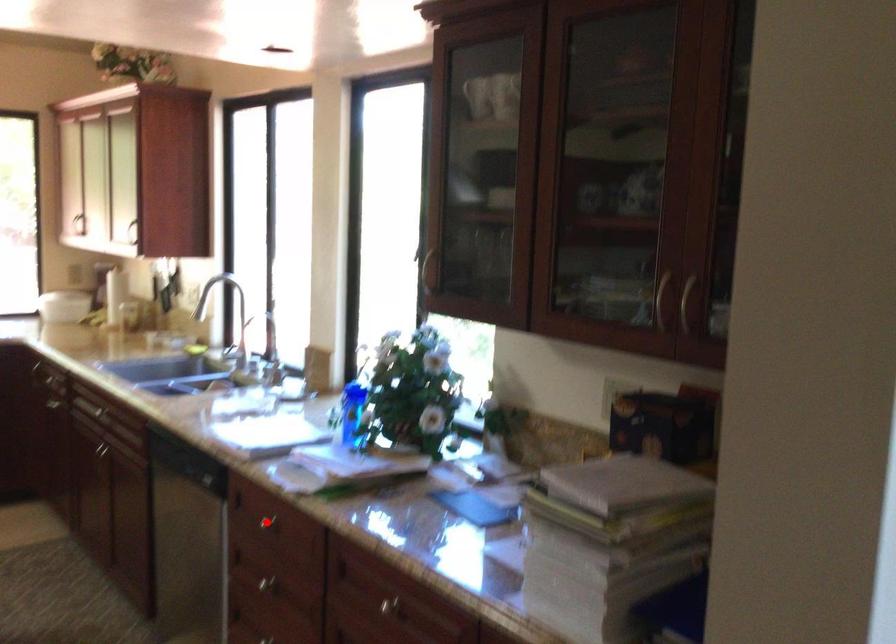
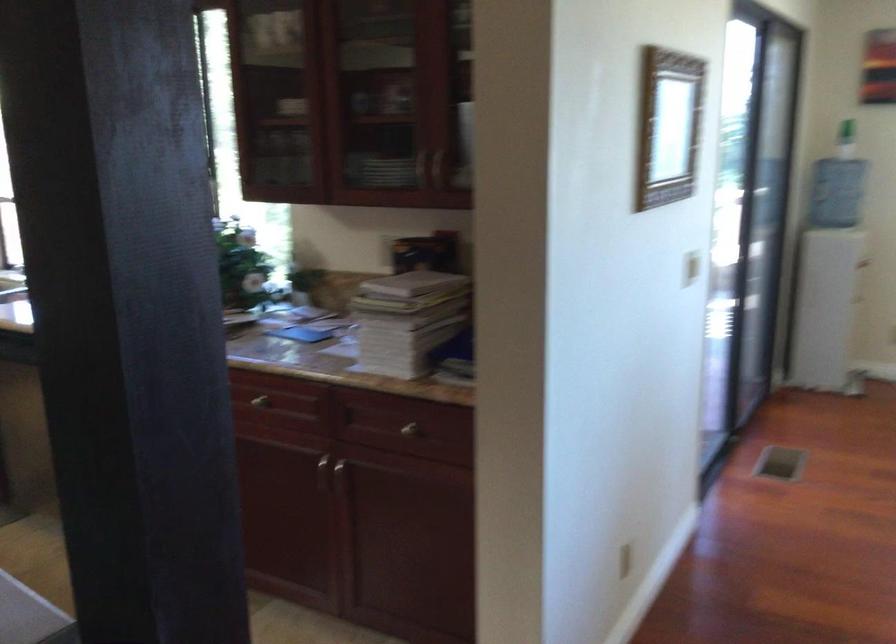
Question: I am providing you with two images of the same scene from different viewpoints. A red point is marked on the first image. Is the red point's position out of view in image 2?

Choices:
 (A) Yes
 (B) No

Answer: (A)